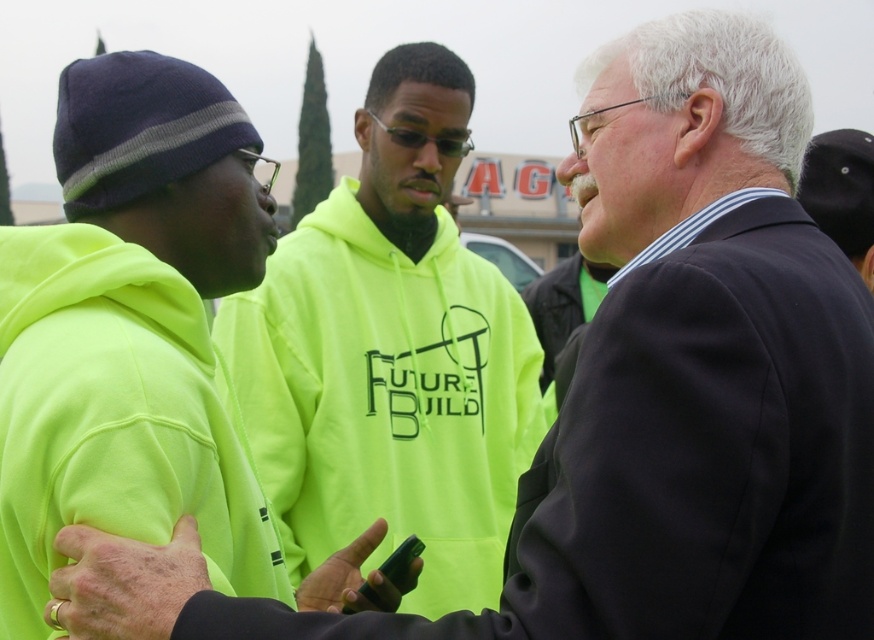
You are standing at the point with coordinates point [112,548] and want to walk towards the point with coordinates point [341,285]. Will you be moving forward or backward relative to your current position?

Since point [341,285] is behind point [112,548], moving towards it would mean you are moving backward relative to your current position at point [112,548].